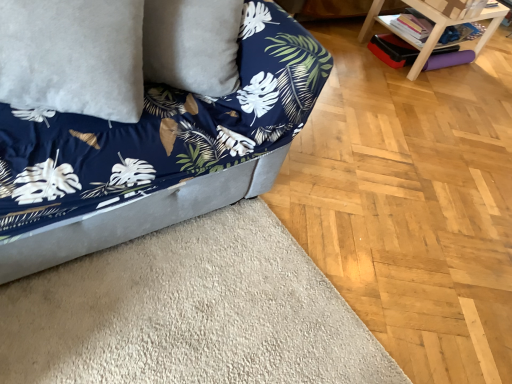
Question: Is the position of velvet blue couch at lower left less distant than that of white fluffy pillow at upper left?

Choices:
 (A) yes
 (B) no

Answer: (A)

Question: Considering the relative sizes of velvet blue couch at lower left and white fluffy pillow at upper left in the image provided, is velvet blue couch at lower left thinner than white fluffy pillow at upper left?

Choices:
 (A) no
 (B) yes

Answer: (A)

Question: Can you confirm if velvet blue couch at lower left is smaller than white fluffy pillow at upper left?

Choices:
 (A) yes
 (B) no

Answer: (B)

Question: Is velvet blue couch at lower left positioned beyond the bounds of white fluffy pillow at upper left?

Choices:
 (A) yes
 (B) no

Answer: (A)

Question: Is velvet blue couch at lower left far away from white fluffy pillow at upper left?

Choices:
 (A) no
 (B) yes

Answer: (A)

Question: Considering the positions of wooden table at upper right and velvet blue couch at lower left in the image, is wooden table at upper right wider or thinner than velvet blue couch at lower left?

Choices:
 (A) thin
 (B) wide

Answer: (A)

Question: Is wooden table at upper right in front of or behind velvet blue couch at lower left in the image?

Choices:
 (A) behind
 (B) front

Answer: (A)

Question: From a real-world perspective, is wooden table at upper right above or below velvet blue couch at lower left?

Choices:
 (A) below
 (B) above

Answer: (A)

Question: Is wooden table at upper right inside or outside of velvet blue couch at lower left?

Choices:
 (A) inside
 (B) outside

Answer: (B)

Question: In terms of size, does wooden table at upper right appear bigger or smaller than white fluffy pillow at upper left?

Choices:
 (A) small
 (B) big

Answer: (B)

Question: Would you say wooden table at upper right is inside or outside white fluffy pillow at upper left?

Choices:
 (A) inside
 (B) outside

Answer: (B)

Question: Is wooden table at upper right wider or thinner than white fluffy pillow at upper left?

Choices:
 (A) wide
 (B) thin

Answer: (A)

Question: Is point (379, 8) closer or farther from the camera than point (131, 52)?

Choices:
 (A) closer
 (B) farther

Answer: (B)

Question: Is white fluffy pillow at upper left in front of or behind velvet blue couch at lower left in the image?

Choices:
 (A) behind
 (B) front

Answer: (A)

Question: Do you think white fluffy pillow at upper left is within velvet blue couch at lower left, or outside of it?

Choices:
 (A) inside
 (B) outside

Answer: (A)